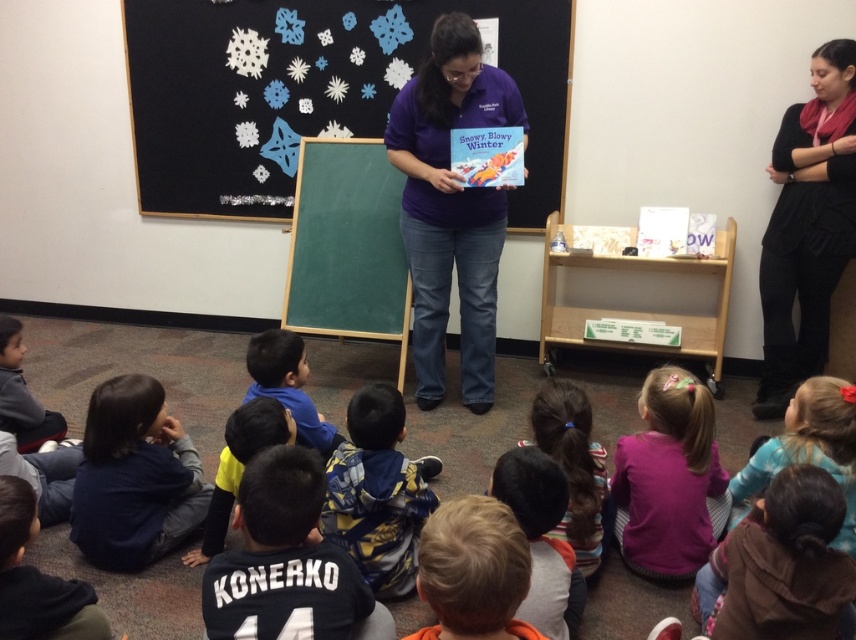
Question: Which point is farther from the camera taking this photo?

Choices:
 (A) (479, 497)
 (B) (586, 436)
 (C) (629, 488)

Answer: (C)

Question: Is blue jersey at center above purple fleece shirt at lower center?

Choices:
 (A) no
 (B) yes

Answer: (A)

Question: Which object appears closest to the camera in this image?

Choices:
 (A) dark brown hair at center
 (B) purple fleece shirt at lower center

Answer: (A)

Question: Which point is farther from the camera taking this photo?

Choices:
 (A) (236, 422)
 (B) (276, 106)
 (C) (614, 490)

Answer: (B)

Question: Considering the relative positions of purple cotton shirt at center and blue camouflage jacket at center in the image provided, where is purple cotton shirt at center located with respect to blue camouflage jacket at center?

Choices:
 (A) right
 (B) left

Answer: (A)

Question: Does blue jersey at center lie behind purple fleece shirt at lower center?

Choices:
 (A) no
 (B) yes

Answer: (A)